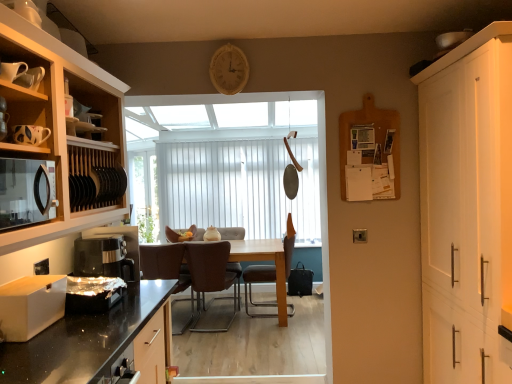
The width and height of the screenshot is (512, 384). What do you see at coordinates (164, 264) in the screenshot?
I see `brown leather chair at center, arranged as the 3th chair when viewed from the right` at bounding box center [164, 264].

What do you see at coordinates (92, 294) in the screenshot? I see `shiny metallic toaster at lower left, the 2th appliance from the front` at bounding box center [92, 294].

Image resolution: width=512 pixels, height=384 pixels. Find the location of `brown leather chair at center, which ranks as the 2th chair in right-to-left order`. brown leather chair at center, which ranks as the 2th chair in right-to-left order is located at coordinates (232, 233).

What do you see at coordinates (103, 257) in the screenshot? This screenshot has width=512, height=384. I see `black plastic coffee machine at lower left` at bounding box center [103, 257].

Where is `brown leather chair at center, the third chair from the left`? brown leather chair at center, the third chair from the left is located at coordinates (258, 282).

What is the approximate width of brown leather chair at center, marked as the 1th chair in a right-to-left arrangement?

brown leather chair at center, marked as the 1th chair in a right-to-left arrangement, is 24.19 inches in width.

Find the location of a particular element. This screenshot has height=384, width=512. brown leather chair at center, arranged as the 3th chair when viewed from the right is located at coordinates (164, 264).

Which object is further away from the camera taking this photo, white vertical blinds at center or brown leather chair at center, arranged as the 3th chair when viewed from the right?

white vertical blinds at center.

Considering the sizes of objects white vertical blinds at center and brown leather chair at center, marked as the first chair in a left-to-right arrangement, in the image provided, who is taller, white vertical blinds at center or brown leather chair at center, marked as the first chair in a left-to-right arrangement,?

With more height is white vertical blinds at center.

Considering the positions of objects white vertical blinds at center and brown leather chair at center, marked as the first chair in a left-to-right arrangement, in the image provided, who is more to the left, white vertical blinds at center or brown leather chair at center, marked as the first chair in a left-to-right arrangement,?

From the viewer's perspective, brown leather chair at center, marked as the first chair in a left-to-right arrangement, appears more on the left side.

Could you tell me if white vertical blinds at center is turned towards brown leather chair at center, arranged as the 3th chair when viewed from the right?

Yes, white vertical blinds at center is facing brown leather chair at center, arranged as the 3th chair when viewed from the right.

Locate an element on the screen. This screenshot has width=512, height=384. the 3rd chair below the white matte drawer at lower left, marked as the second appliance in a right-to-left arrangement (from the image's perspective) is located at coordinates (164, 264).

Does brown leather chair at center, arranged as the 3th chair when viewed from the right, have a greater width compared to white matte drawer at lower left, marked as the second appliance in a right-to-left arrangement?

Yes.

Is brown leather chair at center, marked as the first chair in a left-to-right arrangement, completely or partially outside of white matte drawer at lower left, the 2th appliance positioned from the back?

Answer: That's correct, brown leather chair at center, marked as the first chair in a left-to-right arrangement, is outside of white matte drawer at lower left, the 2th appliance positioned from the back.

From a real-world perspective, which object stands above the other?

white matte drawer at lower left, the 2th appliance positioned from the back.

Is black plastic coffee machine at lower left far from wooden cabinet at left, which ranks as the 2th cabinetry in right-to-left order?

black plastic coffee machine at lower left is near wooden cabinet at left, which ranks as the 2th cabinetry in right-to-left order, not far away.

Is black plastic coffee machine at lower left further to camera compared to wooden cabinet at left, which ranks as the 2th cabinetry in right-to-left order?

Yes.

Could you tell me if black plastic coffee machine at lower left is facing wooden cabinet at left, placed as the 1th cabinetry when sorted from left to right?

No, black plastic coffee machine at lower left is not turned towards wooden cabinet at left, placed as the 1th cabinetry when sorted from left to right.

Can you confirm if black plastic coffee machine at lower left is thinner than wooden cabinet at left, which ranks as the 2th cabinetry in right-to-left order?

Correct, the width of black plastic coffee machine at lower left is less than that of wooden cabinet at left, which ranks as the 2th cabinetry in right-to-left order.

Is shiny metallic toaster at lower left, which is the 1th appliance in back-to-front order, next to white vertical blinds at center?

No, shiny metallic toaster at lower left, which is the 1th appliance in back-to-front order, is not in contact with white vertical blinds at center.

From a real-world perspective, which object rests below the other?

From a 3D spatial view, shiny metallic toaster at lower left, which is the 1th appliance in back-to-front order, is below.

Where is `window that is above the shiny metallic toaster at lower left, which is the first appliance in right-to-left order (from a real-world perspective)`? Image resolution: width=512 pixels, height=384 pixels. window that is above the shiny metallic toaster at lower left, which is the first appliance in right-to-left order (from a real-world perspective) is located at coordinates (236, 160).

From the image's perspective, does brown leather chair at center, marked as the first chair in a left-to-right arrangement, appear lower than brown leather chair at center, which ranks as the 2th chair in right-to-left order?

Correct, brown leather chair at center, marked as the first chair in a left-to-right arrangement, appears lower than brown leather chair at center, which ranks as the 2th chair in right-to-left order, in the image.

In the image, is brown leather chair at center, arranged as the 3th chair when viewed from the right, positioned in front of or behind brown leather chair at center, the second chair when ordered from left to right?

In the image, brown leather chair at center, arranged as the 3th chair when viewed from the right, appears in front of brown leather chair at center, the second chair when ordered from left to right.

Is brown leather chair at center, marked as the first chair in a left-to-right arrangement, positioned with its back to brown leather chair at center, which ranks as the 2th chair in right-to-left order?

brown leather chair at center, marked as the first chair in a left-to-right arrangement, does not have its back to brown leather chair at center, which ranks as the 2th chair in right-to-left order.

Which is closer, (191, 319) or (233, 264)?

Point (191, 319) is farther from the camera than point (233, 264).

Are brown leather chair at center, the third chair from the left, and black matte microwave at left making contact?

No, brown leather chair at center, the third chair from the left, is not making contact with black matte microwave at left.

From the image's perspective, count 1st chairs downward from the black matte microwave at left and point to it. Please provide its 2D coordinates.

[(258, 282)]

Which point is more forward, (x=286, y=238) or (x=12, y=196)?

The point (x=12, y=196) is closer.

Is brown leather chair at center, marked as the 1th chair in a right-to-left arrangement, facing away from black matte microwave at left?

No.

Is black matte microwave at left closer to the viewer compared to brown leather chair at center, the second chair when ordered from left to right?

Yes, it is in front of brown leather chair at center, the second chair when ordered from left to right.

Looking at this image, from a real-world perspective, is black matte microwave at left under brown leather chair at center, which ranks as the 2th chair in right-to-left order?

No, from a real-world perspective, black matte microwave at left is not beneath brown leather chair at center, which ranks as the 2th chair in right-to-left order.

Is black matte microwave at left bigger than brown leather chair at center, which ranks as the 2th chair in right-to-left order?

No.

The image size is (512, 384). Identify the location of window above the brown leather chair at center, arranged as the 3th chair when viewed from the right (from a real-world perspective). (236, 160).

At what (x,y) coordinates should I click in order to perform the action: click on appliance that is the 2nd one when counting upward from the brown leather chair at center, marked as the first chair in a left-to-right arrangement (from the image's perspective). Please return your answer as a coordinate pair (x, y). This screenshot has height=384, width=512. Looking at the image, I should click on (31, 305).

Considering their positions, is white vertical blinds at center positioned closer to brown leather chair at center, the third chair from the left, than brown leather chair at center, the second chair when ordered from left to right?

brown leather chair at center, the second chair when ordered from left to right, is positioned closer to the anchor brown leather chair at center, the third chair from the left.

Looking at the image, which one is located closer to brown leather chair at center, the second chair when ordered from left to right, wooden cabinet at left, placed as the 1th cabinetry when sorted from left to right, or white matte drawer at lower left, marked as the second appliance in a right-to-left arrangement?

Among the two, wooden cabinet at left, placed as the 1th cabinetry when sorted from left to right, is located nearer to brown leather chair at center, the second chair when ordered from left to right.

When comparing their distances from wooden cabinet at left, which ranks as the 2th cabinetry in right-to-left order, does black matte microwave at left or white matte cabinet at right, the first cabinetry when ordered from right to left, seem closer?

black matte microwave at left.

When comparing their distances from shiny metallic toaster at lower left, the 2th appliance from the front, does brown leather chair at center, the second chair when ordered from left to right, or wooden cabinet at left, placed as the 1th cabinetry when sorted from left to right, seem closer?

Among the two, wooden cabinet at left, placed as the 1th cabinetry when sorted from left to right, is located nearer to shiny metallic toaster at lower left, the 2th appliance from the front.

When comparing their distances from black plastic coffee machine at lower left, does wooden cabinet at left, which ranks as the 2th cabinetry in right-to-left order, or brown leather chair at center, marked as the first chair in a left-to-right arrangement, seem closer?

wooden cabinet at left, which ranks as the 2th cabinetry in right-to-left order, is positioned closer to the anchor black plastic coffee machine at lower left.

From the image, which object appears to be nearer to white matte cabinet at right, the second cabinetry from the left, white matte drawer at lower left, which is the first appliance from left to right, or brown leather chair at center, marked as the 1th chair in a right-to-left arrangement?

brown leather chair at center, marked as the 1th chair in a right-to-left arrangement.

Considering their positions, is black matte microwave at left positioned closer to white matte drawer at lower left, the 2th appliance positioned from the back, than wooden clock at upper center?

The object closer to white matte drawer at lower left, the 2th appliance positioned from the back, is black matte microwave at left.

When comparing their distances from white matte cabinet at right, the first cabinetry when ordered from right to left, does brown leather chair at center, the second chair when ordered from left to right, or brown leather chair at center, marked as the 1th chair in a right-to-left arrangement, seem closer?

Based on the image, brown leather chair at center, marked as the 1th chair in a right-to-left arrangement, appears to be nearer to white matte cabinet at right, the first cabinetry when ordered from right to left.

The height and width of the screenshot is (384, 512). Find the location of `kitchen appliance between wooden cabinet at left, which ranks as the 2th cabinetry in right-to-left order, and white matte drawer at lower left, marked as the second appliance in a right-to-left arrangement, in the vertical direction`. kitchen appliance between wooden cabinet at left, which ranks as the 2th cabinetry in right-to-left order, and white matte drawer at lower left, marked as the second appliance in a right-to-left arrangement, in the vertical direction is located at coordinates (26, 192).

Find the location of a particular element. Image resolution: width=512 pixels, height=384 pixels. clock located between wooden cabinet at left, placed as the 1th cabinetry when sorted from left to right, and brown leather chair at center, arranged as the 3th chair when viewed from the right, in the depth direction is located at coordinates (229, 69).

Locate an element on the screen. coffee machine between shiny metallic toaster at lower left, the 2th appliance from the front, and white vertical blinds at center from front to back is located at coordinates (103, 257).

Where is `chair between white matte cabinet at right, the first cabinetry when ordered from right to left, and brown leather chair at center, marked as the 1th chair in a right-to-left arrangement, along the z-axis`? chair between white matte cabinet at right, the first cabinetry when ordered from right to left, and brown leather chair at center, marked as the 1th chair in a right-to-left arrangement, along the z-axis is located at coordinates (164, 264).